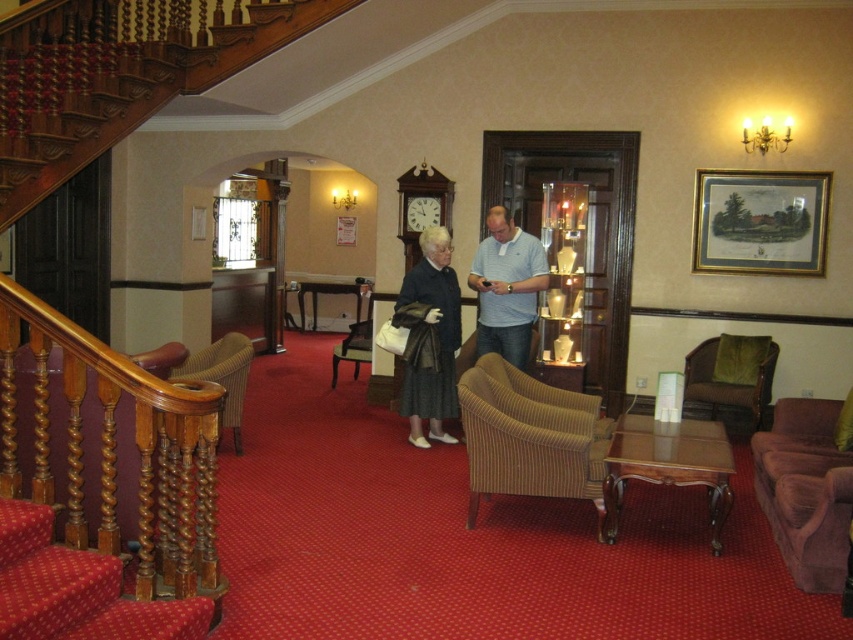
Looking at this image, between light blue striped polo shirt at center and brown textured armchair at center, which one appears on the left side from the viewer's perspective?

brown textured armchair at center

Who is lower down, light blue striped polo shirt at center or brown textured armchair at center?

brown textured armchair at center is lower down.

Between point (531, 328) and point (370, 301), which one is positioned behind?

Point (370, 301)

In order to click on light blue striped polo shirt at center in this screenshot , I will do `click(508, 288)`.

Which is more to the left, matte black dress at center or matte black coat at center?

matte black coat at center is more to the left.

Between matte black dress at center and matte black coat at center, which one is positioned lower?

matte black coat at center is below.

Which is in front, point (514, 352) or point (444, 435)?

Point (514, 352)

This screenshot has width=853, height=640. In order to click on matte black dress at center in this screenshot , I will do `click(508, 288)`.

Is matte black dress at center below green fabric armchair at right?

Actually, matte black dress at center is above green fabric armchair at right.

Between matte black dress at center and green fabric armchair at right, which one appears on the right side from the viewer's perspective?

Positioned to the right is green fabric armchair at right.

Where is `matte black dress at center`? Image resolution: width=853 pixels, height=640 pixels. matte black dress at center is located at coordinates (508, 288).